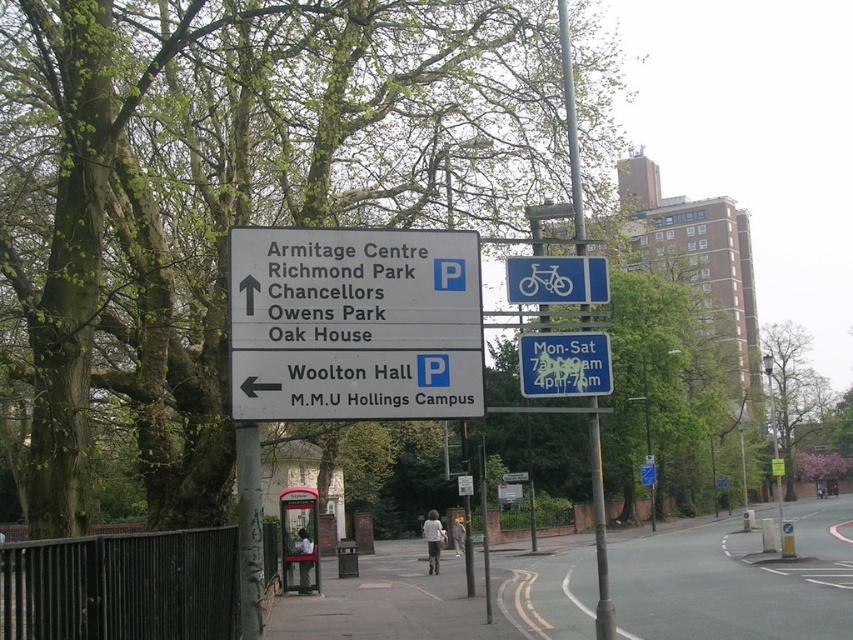
Based on the photo, you are driving a car and see the gray asphalt road at lower center and the blue plastic sign at upper center. Which one is located to the right of the other?

The gray asphalt road at lower center is positioned on the right side of the blue plastic sign at upper center.

You are a delivery person with a bicycle that has a wheelbase of 20 inches. You need to pass between the blue plastic sign at upper center and the blue plastic bicycle at upper center. Can your bicycle fit through the space between them?

The blue plastic sign at upper center and the blue plastic bicycle at upper center are 21.77 inches apart from each other. Since the bicycle has a wheelbase of 20 inches, which is shorter than the 21.77 inches gap, the bicycle can fit through the space between them.